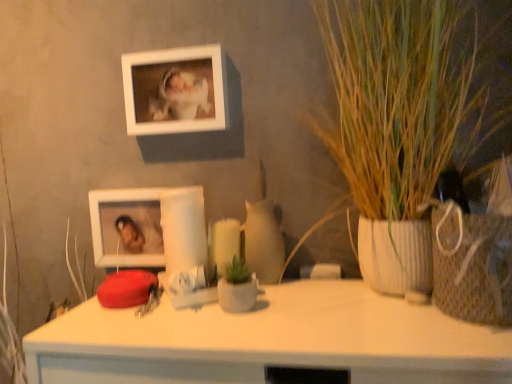
Question: Does green textured plant at right have a greater height compared to white matte picture frame at upper center, marked as the second picture frame in a bottom-to-top arrangement?

Choices:
 (A) no
 (B) yes

Answer: (B)

Question: Is green textured plant at right further to camera compared to white matte picture frame at upper center, marked as the second picture frame in a bottom-to-top arrangement?

Choices:
 (A) no
 (B) yes

Answer: (A)

Question: Is green textured plant at right with white matte picture frame at upper center, marked as the second picture frame in a bottom-to-top arrangement?

Choices:
 (A) no
 (B) yes

Answer: (A)

Question: Is green textured plant at right bigger than white matte picture frame at upper center, marked as the second picture frame in a bottom-to-top arrangement?

Choices:
 (A) no
 (B) yes

Answer: (B)

Question: From a real-world perspective, is green textured plant at right physically above white matte picture frame at upper center, marked as the second picture frame in a bottom-to-top arrangement?

Choices:
 (A) no
 (B) yes

Answer: (A)

Question: Is green textured plant at right in front of white matte picture frame at upper center, marked as the second picture frame in a bottom-to-top arrangement?

Choices:
 (A) no
 (B) yes

Answer: (B)

Question: Considering the relative sizes of white matte picture frame at upper center, marked as the second picture frame in a bottom-to-top arrangement, and matte white candle at center in the image provided, is white matte picture frame at upper center, marked as the second picture frame in a bottom-to-top arrangement, wider than matte white candle at center?

Choices:
 (A) no
 (B) yes

Answer: (A)

Question: Is white matte picture frame at upper center, the 1th picture frame from the top, thinner than matte white candle at center?

Choices:
 (A) yes
 (B) no

Answer: (A)

Question: Considering the relative sizes of white matte picture frame at upper center, the 1th picture frame from the top, and matte white candle at center in the image provided, is white matte picture frame at upper center, the 1th picture frame from the top, bigger than matte white candle at center?

Choices:
 (A) no
 (B) yes

Answer: (B)

Question: From the image's perspective, is white matte picture frame at upper center, the 1th picture frame from the top, located above matte white candle at center?

Choices:
 (A) no
 (B) yes

Answer: (B)

Question: Does white matte picture frame at upper center, the 1th picture frame from the top, contain matte white candle at center?

Choices:
 (A) yes
 (B) no

Answer: (B)

Question: Can you confirm if white matte picture frame at upper center, the 1th picture frame from the top, is taller than matte white candle at center?

Choices:
 (A) yes
 (B) no

Answer: (A)

Question: Is green textured plant at right far away from white glossy picture frame at lower left, marked as the first picture frame in a bottom-to-top arrangement?

Choices:
 (A) no
 (B) yes

Answer: (A)